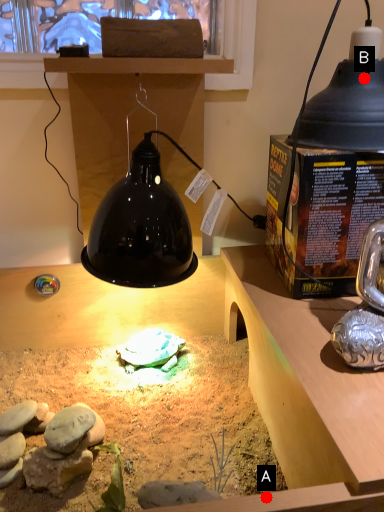
Question: Two points are circled on the image, labeled by A and B beside each circle. Which of the following is the closest to the observer?

Choices:
 (A) A is closer
 (B) B is closer

Answer: (A)